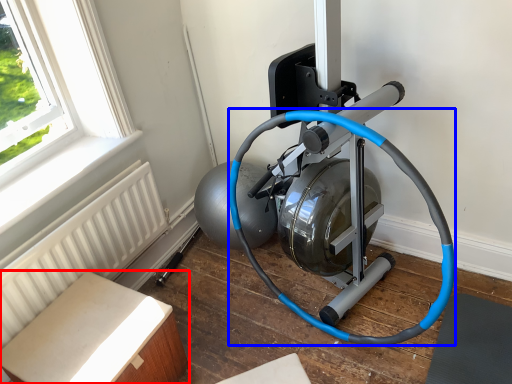
Question: Among these objects, which one is nearest to the camera, furniture (highlighted by a red box) or garden hose (highlighted by a blue box)?

Choices:
 (A) furniture
 (B) garden hose

Answer: (B)